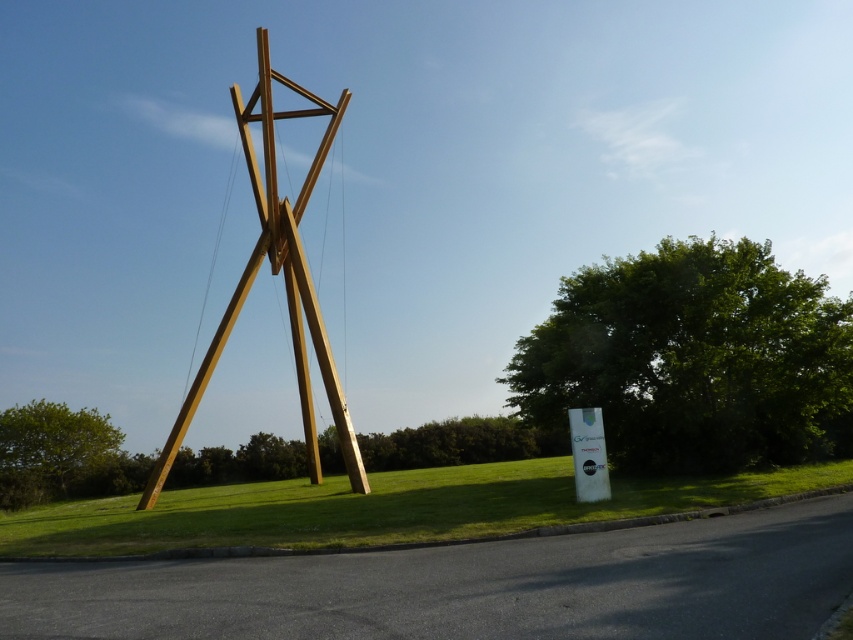
Is green leafy tree at center to the right of green grass at center from the viewer's perspective?

Yes, green leafy tree at center is to the right of green grass at center.

Between green leafy tree at center and green grass at center, which one appears on the right side from the viewer's perspective?

Positioned to the right is green leafy tree at center.

The width and height of the screenshot is (853, 640). Find the location of `green leafy tree at center`. green leafy tree at center is located at coordinates (694, 358).

Find the location of a particular element. This screenshot has width=853, height=640. green leafy tree at center is located at coordinates (694, 358).

Is point (310, 180) closer to viewer compared to point (42, 436)?

Yes, point (310, 180) is closer to viewer.

Is natural wood sculpture at center above green leafy tree at lower left?

Indeed, natural wood sculpture at center is positioned over green leafy tree at lower left.

At what (x,y) coordinates should I click in order to perform the action: click on natural wood sculpture at center. Please return your answer as a coordinate pair (x, y). The height and width of the screenshot is (640, 853). Looking at the image, I should click on pyautogui.click(x=276, y=273).

Is green leafy tree at center below green leafy tree at lower left?

Actually, green leafy tree at center is above green leafy tree at lower left.

Can you confirm if green leafy tree at center is smaller than green leafy tree at lower left?

Yes.

Who is more distant from viewer, (608, 346) or (115, 435)?

The point (115, 435) is more distant.

You are a GUI agent. You are given a task and a screenshot of the screen. Output one action in this format:
    pyautogui.click(x=<x>, y=<y>)
    Task: Click on the green leafy tree at center
    The image size is (853, 640).
    Given the screenshot: What is the action you would take?
    point(694,358)